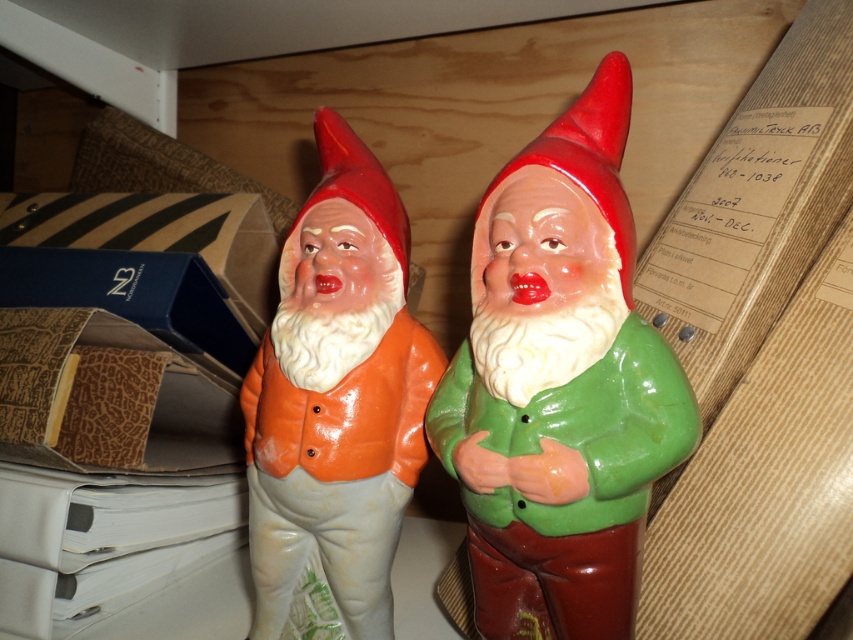
You are organizing a display of office supplies and notice the green glossy gnome at center and the orange glossy vest at center. Which object is placed higher in the image?

The green glossy gnome at center is positioned over the orange glossy vest at center, so it is placed higher in the image.

You are standing in front of two garden gnomes. The green glossy gnome at center is exactly at point (x=560, y=387). If you want to place a new gnome between them, where should you place it?

To place a new gnome between the two existing gnomes, you should position it at point (x=560, y=387), which is the exact center between them.